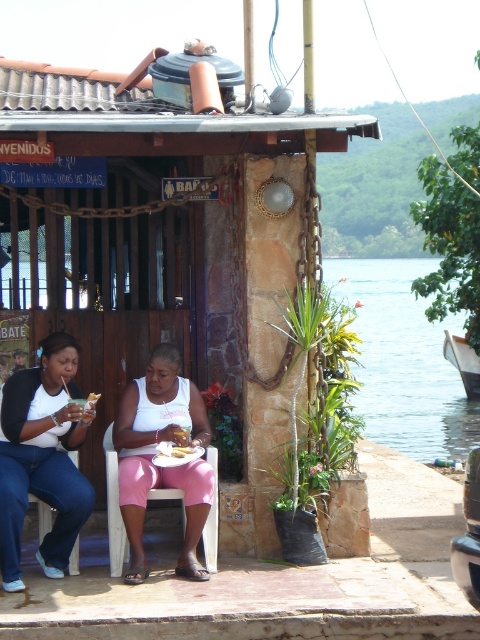
From the picture: Who is taller, transparent water at lower center or denim pants at lower left?

Standing taller between the two is transparent water at lower center.

Can you confirm if transparent water at lower center is shorter than denim pants at lower left?

Incorrect, transparent water at lower center's height does not fall short of denim pants at lower left's.

Which is in front, point (396, 330) or point (16, 532)?

Point (16, 532) is more forward.

At what (x,y) coordinates should I click in order to perform the action: click on transparent water at lower center. Please return your answer as a coordinate pair (x, y). The image size is (480, 640). Looking at the image, I should click on (405, 362).

Does point (76, 394) come in front of point (96, 397)?

No, it is behind (96, 397).

Is denim pants at lower left below golden brown bread at center?

Yes, denim pants at lower left is below golden brown bread at center.

Is point (14, 432) behind point (88, 401)?

That is False.

Find the location of a particular element. This screenshot has width=480, height=640. denim pants at lower left is located at coordinates (43, 458).

Consider the image. Does pink fabric skirt at center have a greater width compared to denim pants at lower left?

Yes.

Is point (29, 461) behind point (69, 509)?

Yes, it is.

Where is `pink fabric skirt at center`? This screenshot has height=640, width=480. pink fabric skirt at center is located at coordinates (43, 456).